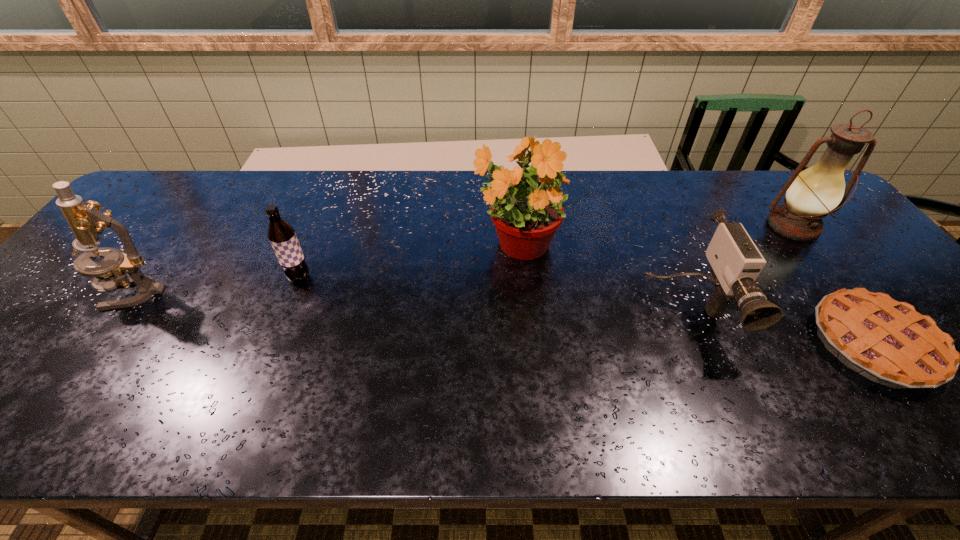
Identify the location of oil lamp at the far edge. This screenshot has height=540, width=960. (811, 194).

This screenshot has height=540, width=960. What are the coordinates of `flowerpot at the far edge` in the screenshot? It's located at (526, 200).

Find the location of a particular element. This screenshot has width=960, height=540. object that is at the left edge is located at coordinates (86, 221).

In order to click on object located at the right edge in this screenshot , I will do pyautogui.click(x=811, y=194).

The image size is (960, 540). I want to click on object present at the far right corner, so click(x=811, y=194).

This screenshot has height=540, width=960. I want to click on vacant region at the far edge, so click(725, 203).

Image resolution: width=960 pixels, height=540 pixels. I want to click on vacant space at the near edge, so click(673, 406).

In the image, there is a desktop. Where is `vacant area at the left edge`? The image size is (960, 540). vacant area at the left edge is located at coordinates (61, 341).

At what (x,y) coordinates should I click in order to perform the action: click on free space at the far left corner of the desktop. Please return your answer as a coordinate pair (x, y). The width and height of the screenshot is (960, 540). Looking at the image, I should click on click(177, 179).

Find the location of `free space between the fourth object from left to right and the fourth object from right to left`. free space between the fourth object from left to right and the fourth object from right to left is located at coordinates (601, 280).